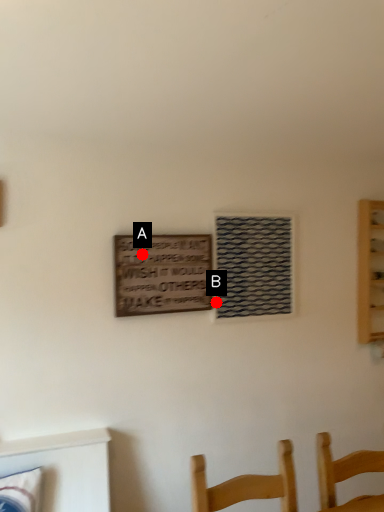
Question: Two points are circled on the image, labeled by A and B beside each circle. Among these points, which one is farthest from the camera?

Choices:
 (A) A is further
 (B) B is further

Answer: (B)